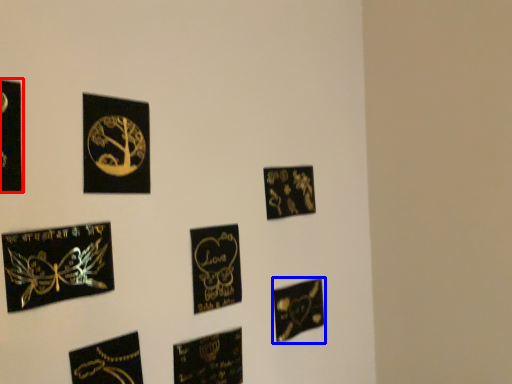
Question: Which object appears closest to the camera in this image, picture frame (highlighted by a red box) or picture frame (highlighted by a blue box)?

Choices:
 (A) picture frame
 (B) picture frame

Answer: (A)